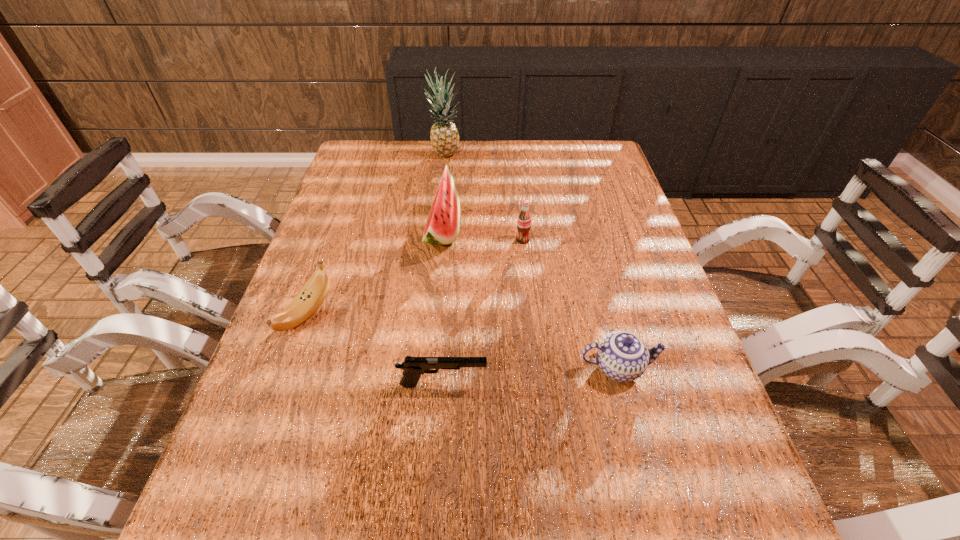
The width and height of the screenshot is (960, 540). In order to click on free point between the soda and the banana in this screenshot , I will do `click(415, 277)`.

Image resolution: width=960 pixels, height=540 pixels. I want to click on free space between the chinaware and the gun, so click(531, 376).

The height and width of the screenshot is (540, 960). Find the location of `the second closest object to the tallest object`. the second closest object to the tallest object is located at coordinates (524, 219).

Where is `object that can be found as the fifth closest to the fifth object from left to right`? object that can be found as the fifth closest to the fifth object from left to right is located at coordinates (312, 295).

I want to click on free spot that satisfies the following two spatial constraints: 1. on the outer rind of the watermelon; 2. on the left side of the soda, so click(x=442, y=240).